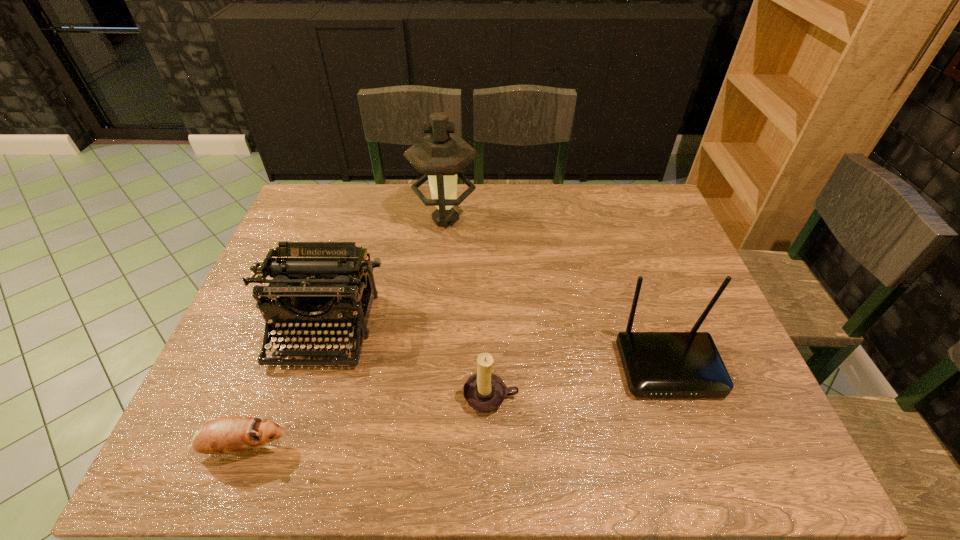
The image size is (960, 540). What are the coordinates of `vacant area located 0.200m at the face of the hamster` in the screenshot? It's located at (387, 448).

The image size is (960, 540). In order to click on object at the far edge in this screenshot , I will do `click(439, 156)`.

You are a GUI agent. You are given a task and a screenshot of the screen. Output one action in this format:
    pyautogui.click(x=<x>, y=<y>)
    Task: Click on the object that is positioned at the near edge
    The height and width of the screenshot is (540, 960).
    Given the screenshot: What is the action you would take?
    pyautogui.click(x=224, y=435)

Locate an element on the screen. typewriter situated at the left edge is located at coordinates (317, 284).

Where is `hamster that is at the left edge`? This screenshot has width=960, height=540. hamster that is at the left edge is located at coordinates (224, 435).

Locate an element on the screen. The width and height of the screenshot is (960, 540). object present at the right edge is located at coordinates (656, 364).

Identify the location of object present at the near left corner. This screenshot has width=960, height=540. 224,435.

Find the location of a particular element. This screenshot has width=960, height=540. vacant space at the far edge of the desktop is located at coordinates (462, 214).

Identify the location of free space at the near edge. Image resolution: width=960 pixels, height=540 pixels. (636, 431).

Locate an element on the screen. The image size is (960, 540). free space at the right edge of the desktop is located at coordinates (628, 237).